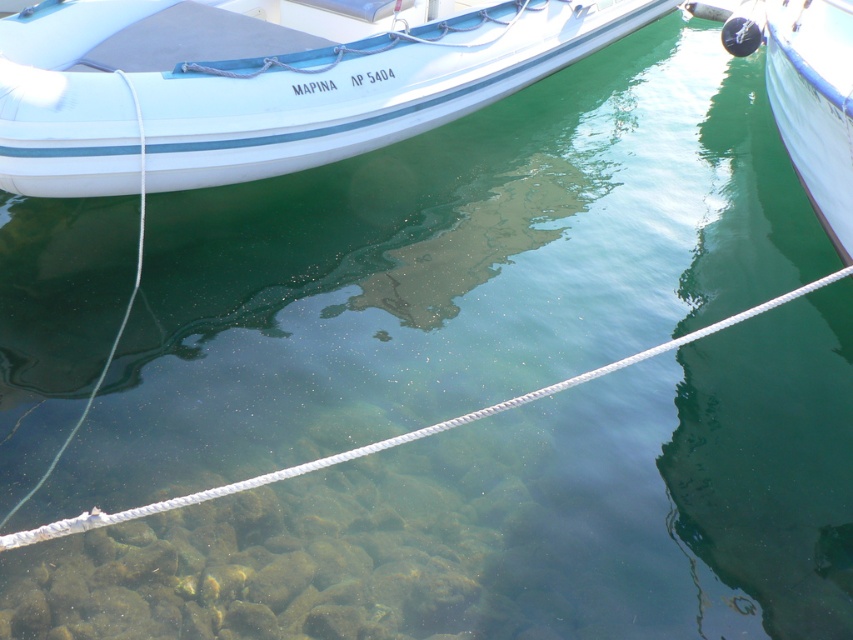
Question: Which of the following is the farthest from the observer?

Choices:
 (A) (318, 35)
 (B) (230, 488)

Answer: (A)

Question: Is white matte boat at upper left bigger than white rope at center?

Choices:
 (A) yes
 (B) no

Answer: (A)

Question: Does white matte boat at upper left appear over white rope at center?

Choices:
 (A) no
 (B) yes

Answer: (B)

Question: Which point is farther to the camera?

Choices:
 (A) white matte boat at upper left
 (B) white rope at center

Answer: (A)

Question: Does white matte boat at upper left have a smaller size compared to white rope at center?

Choices:
 (A) yes
 (B) no

Answer: (B)

Question: Which of the following is the farthest from the observer?

Choices:
 (A) white rope at center
 (B) white matte boat at upper left

Answer: (B)